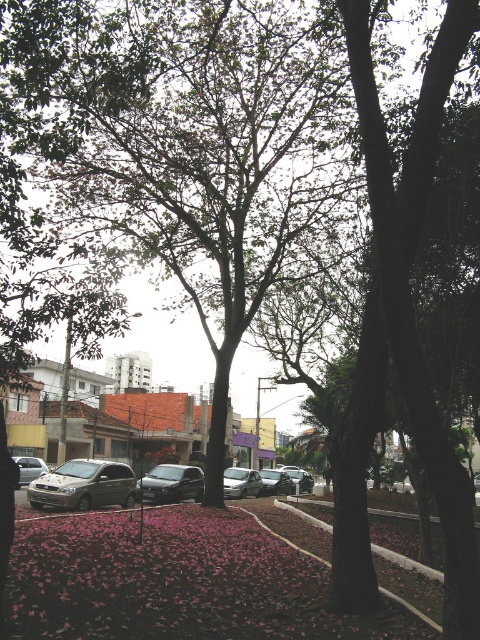
Consider the image. You are a pedestrian trying to cross the street and see the metallic gold minivan at center and the shiny silver sedan at center. Which vehicle is closer to the left side of the road?

The metallic gold minivan at center is positioned on the left side of the shiny silver sedan at center, so it is closer to the left side of the road.

You are a pedestrian standing on the sidewalk and see the pink matte petals at lower center and the metallic gold minivan at center. Which object is closer to your right side?

The pink matte petals at lower center are to the right of the metallic gold minivan at center, so they are closer to your right side.

You are standing at the point with coordinates point (96, 600) and want to walk to point (60, 484). Based on the scene description, will you have to walk towards the background or the foreground?

Since point (96, 600) is in front of point (60, 484), you will need to walk towards the background to reach point (60, 484).